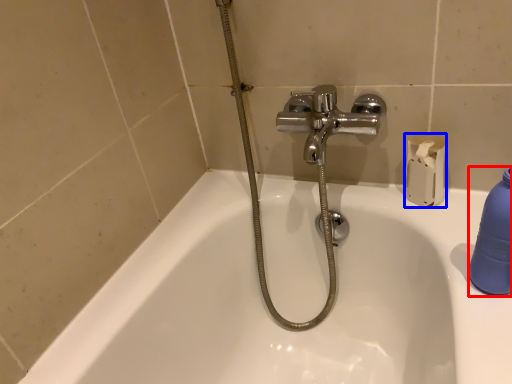
Question: Which of the following is the closest to the observer, cleaning product (highlighted by a red box) or toilet paper (highlighted by a blue box)?

Choices:
 (A) cleaning product
 (B) toilet paper

Answer: (A)